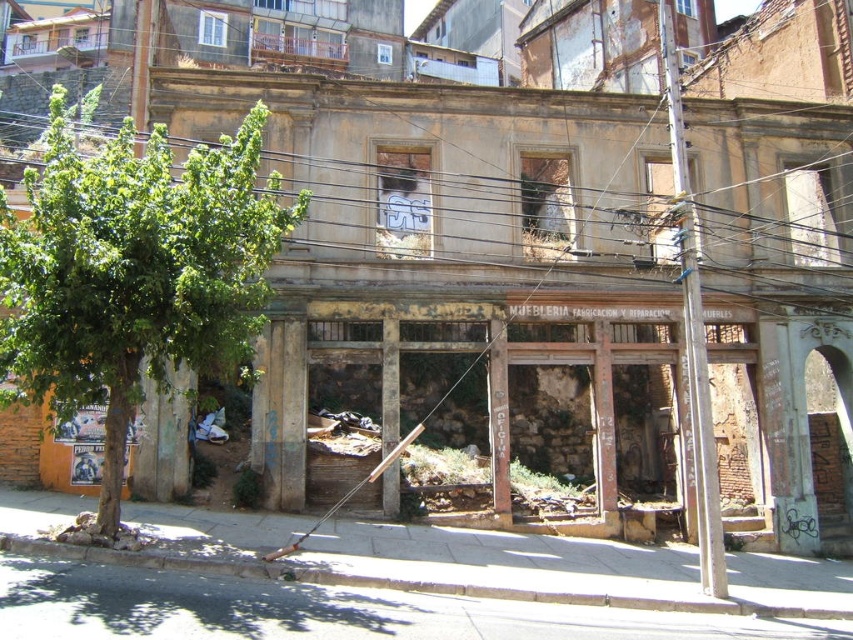
From the picture: Who is lower down, brown wooden power line at upper center or green leafy tree at left?

Positioned lower is green leafy tree at left.

Image resolution: width=853 pixels, height=640 pixels. Identify the location of brown wooden power line at upper center. (531, 193).

Locate an element on the screen. This screenshot has width=853, height=640. brown wooden power line at upper center is located at coordinates (531, 193).